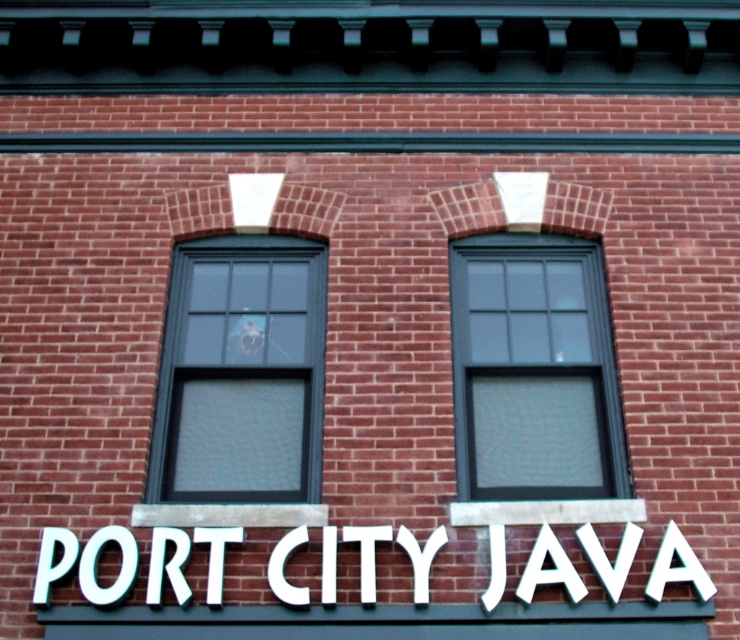
Who is higher up, matte black window at center or white plastic sign at center?

matte black window at center

Is matte black window at center wider than white plastic sign at center?

In fact, matte black window at center might be narrower than white plastic sign at center.

Is point (518, 412) behind point (329, 554)?

Yes, point (518, 412) is farther from viewer.

The image size is (740, 640). In order to click on matte black window at center in this screenshot , I will do `click(534, 371)`.

Does point (289, 477) come behind point (266, 564)?

Yes, it is.

Does matte glass window at center-left appear under white plastic sign at center?

Incorrect, matte glass window at center-left is not positioned below white plastic sign at center.

In order to click on matte glass window at center-left in this screenshot , I will do `click(240, 372)`.

Which is more to the left, matte glass window at center-left or matte black window at center?

matte glass window at center-left is more to the left.

Which is above, matte glass window at center-left or matte black window at center?

matte black window at center is higher up.

Is point (275, 474) closer to camera compared to point (598, 438)?

Yes.

What are the coordinates of `matte glass window at center-left` in the screenshot? It's located at (240, 372).